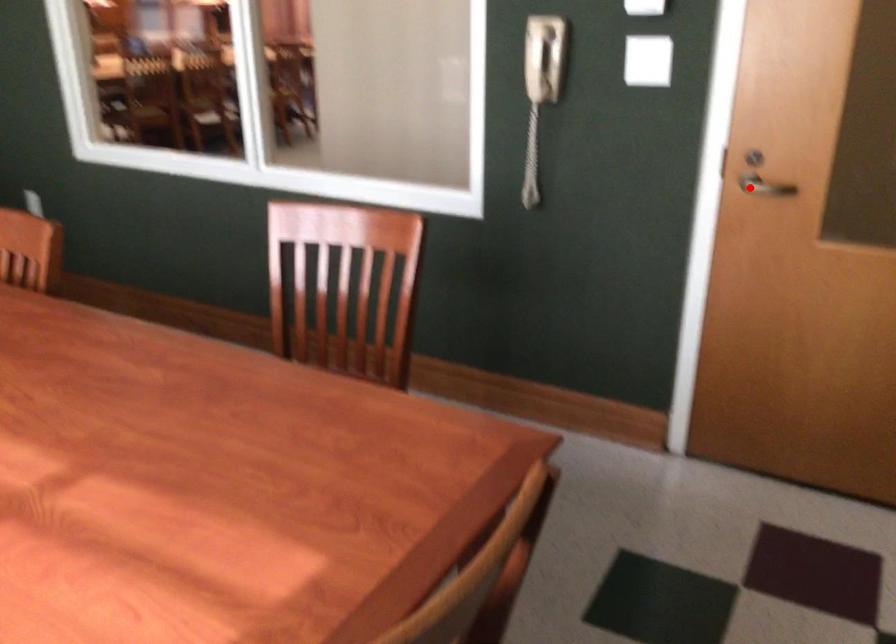
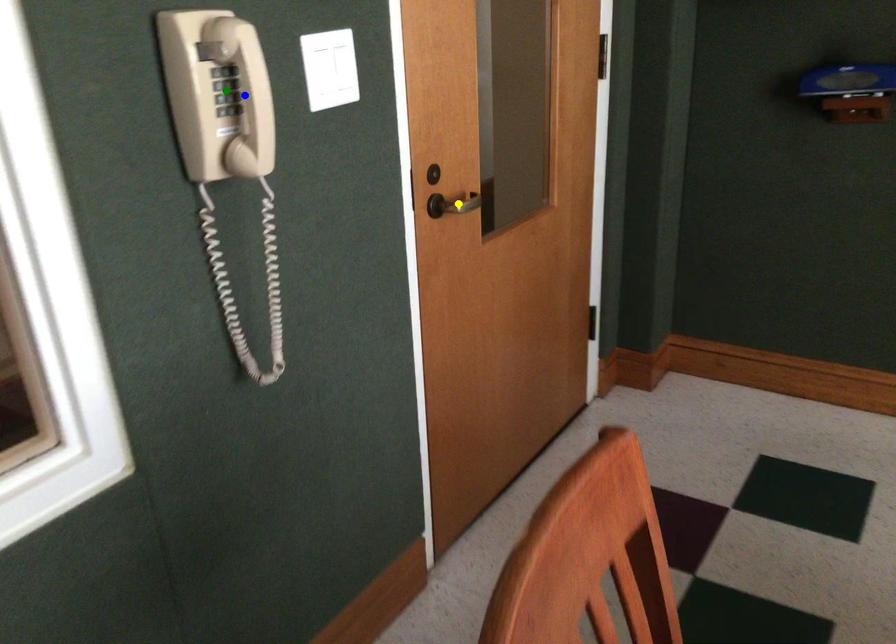
Question: I am providing you with two images of the same scene from different viewpoints. A red point is marked on the first image. You are given multiple points on the second image. Which point in image 2 is actually the same real-world point as the red point in image 1?

Choices:
 (A) blue point
 (B) green point
 (C) yellow point

Answer: (C)